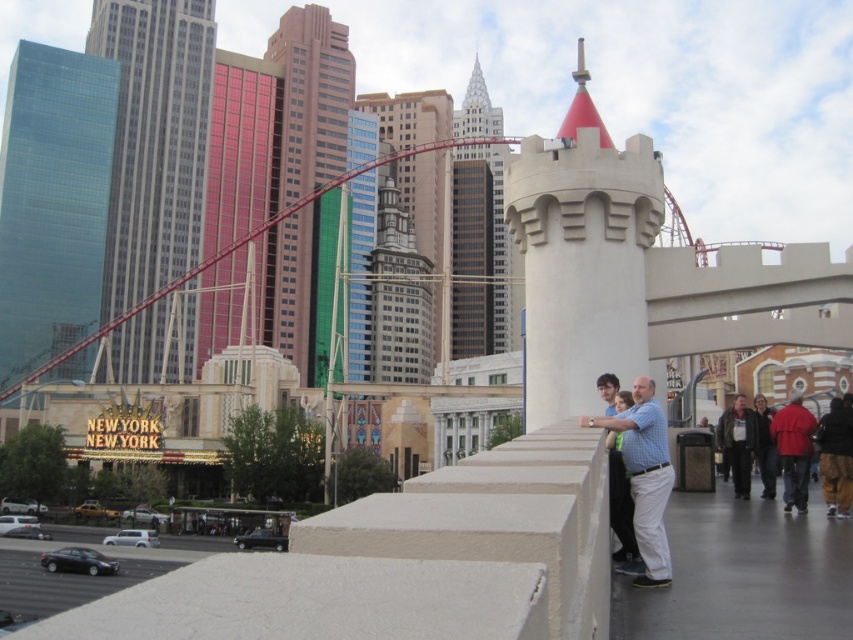
You are standing at the concrete barrier in the urban scene and want to take a photo of both the point at coordinates point (117,90) and the point at coordinates point (416,109). Which point will appear larger in your photo?

Point (117,90) will appear larger in the photo because it is closer to the viewer than point (416,109).

You are a photographer standing at the edge of the scene. You want to capture both the white stone tower at center and the red jacket at lower right in one shot. Given that your camera has a fixed focal length, which object should you position closer to the camera to ensure both are in frame?

Since the white stone tower at center is bigger than the red jacket at lower right, you should position the red jacket at lower right closer to the camera to ensure both fit within the frame.